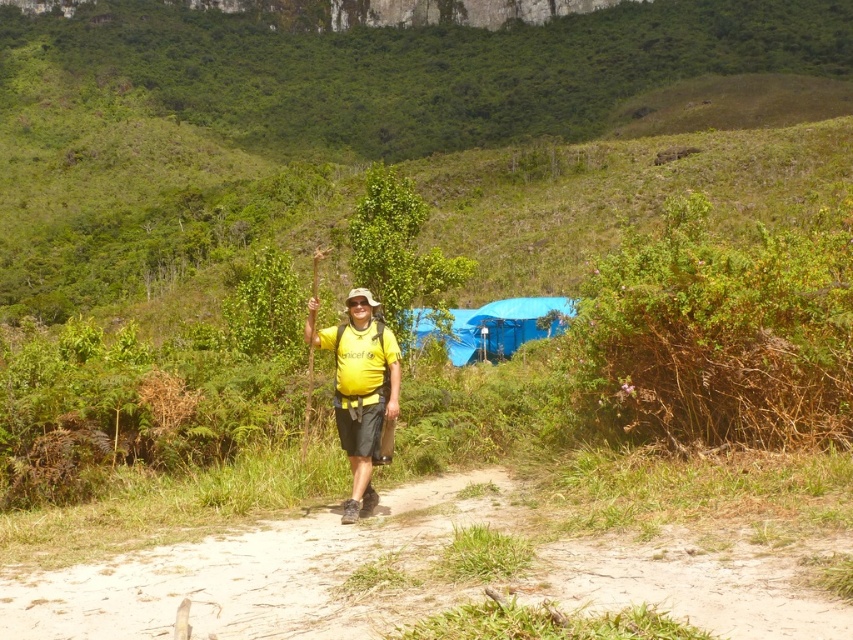
You are a hiker trying to decide whether to walk along the dirt path at center or the green leafy bush at right. Which option will take up more space on the map?

The green leafy bush at right occupies more space than the dirt path at center.

You are a hiker trying to navigate through the dirt path at center. There is a green leafy bush at right nearby. Which direction should you go to avoid the bush?

The dirt path at center is positioned under the green leafy bush at right, so you should go straight along the dirt path at center to avoid the bush.